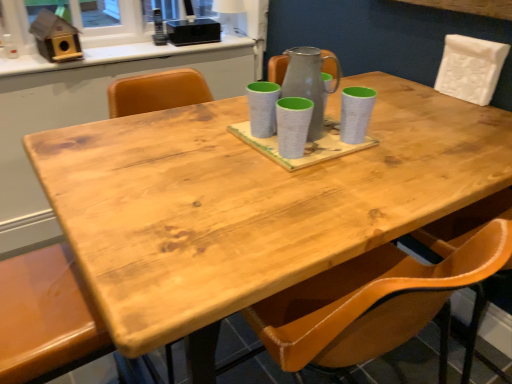
Locate an element on the screen. This screenshot has height=384, width=512. free space in front of matte gray pitcher at center is located at coordinates (313, 175).